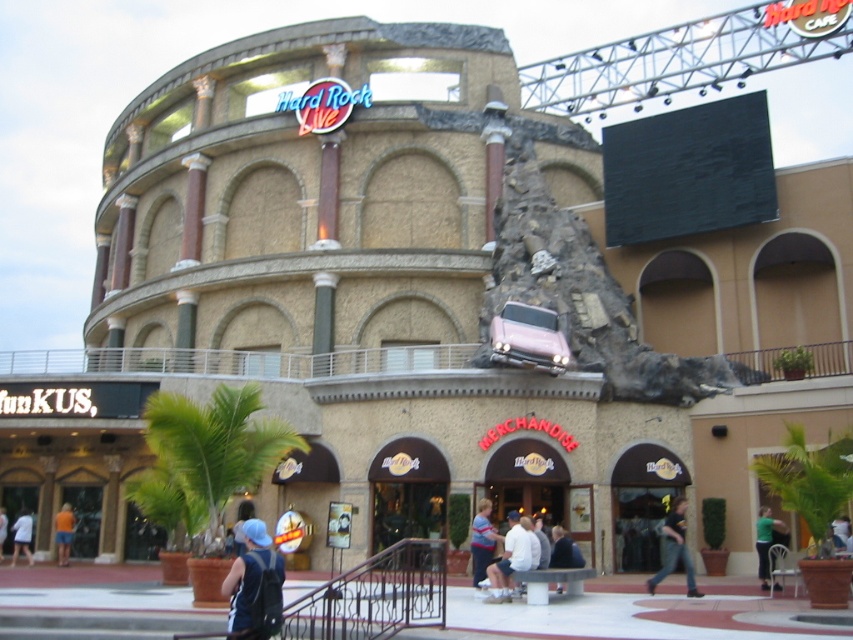
Question: Which point is farther to the camera?

Choices:
 (A) (581, 556)
 (B) (21, 531)
 (C) (764, 512)
 (D) (671, 548)

Answer: (B)

Question: Which object is the farthest from the green fabric shirt at lower right?

Choices:
 (A) denim jacket at lower center
 (B) white cotton shirt at lower left
 (C) light blue denim jacket at lower left

Answer: (C)

Question: Does denim jacket at lower center appear under green fabric shirt at lower right?

Choices:
 (A) yes
 (B) no

Answer: (B)

Question: Which of the following is the closest to the observer?

Choices:
 (A) (492, 596)
 (B) (6, 529)
 (C) (57, 529)

Answer: (A)

Question: Is dark blue shirt at lower center to the right of orange fabric shorts at lower left from the viewer's perspective?

Choices:
 (A) no
 (B) yes

Answer: (B)

Question: Is orange fabric shorts at lower left in front of light blue denim jacket at lower left?

Choices:
 (A) yes
 (B) no

Answer: (B)